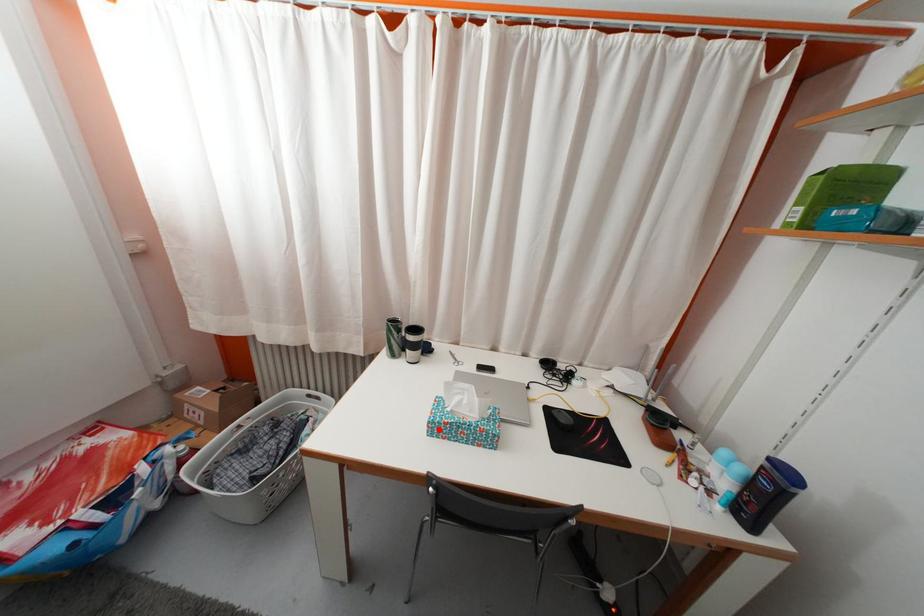
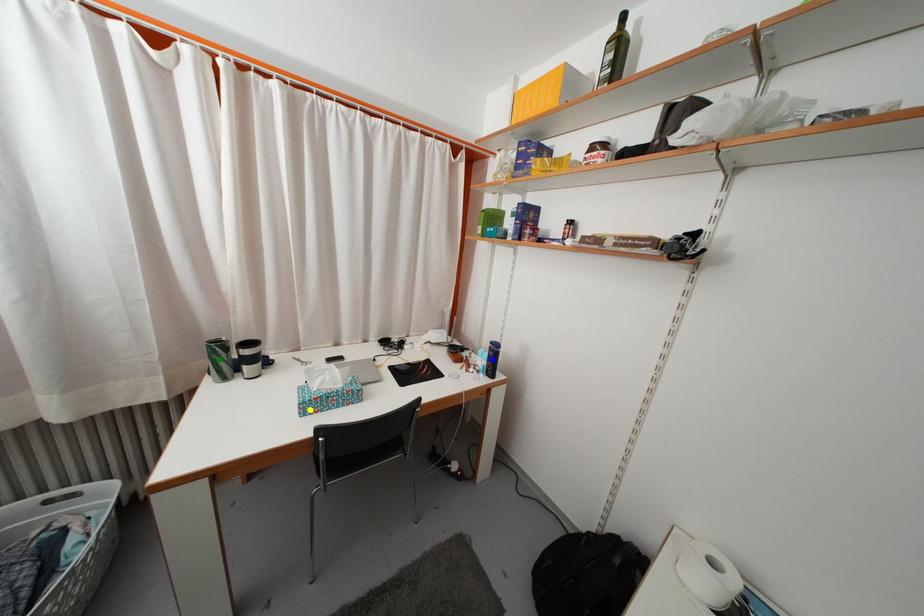
Question: I am providing you with two images of the same scene from different viewpoints. A red point is marked on the first image. You are given multiple points on the second image. Which mark in image 2 goes with the point in image 1?

Choices:
 (A) yellow point
 (B) blue point
 (C) green point

Answer: (A)